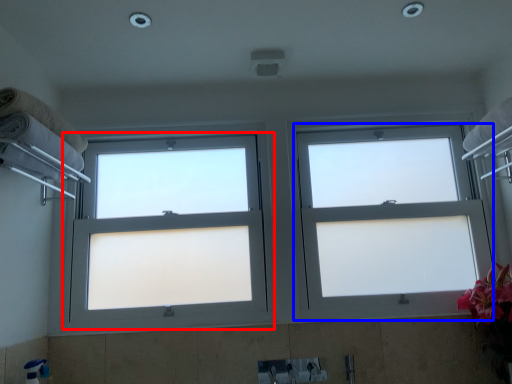
Question: Which object is further to the camera taking this photo, window (highlighted by a red box) or window (highlighted by a blue box)?

Choices:
 (A) window
 (B) window

Answer: (B)